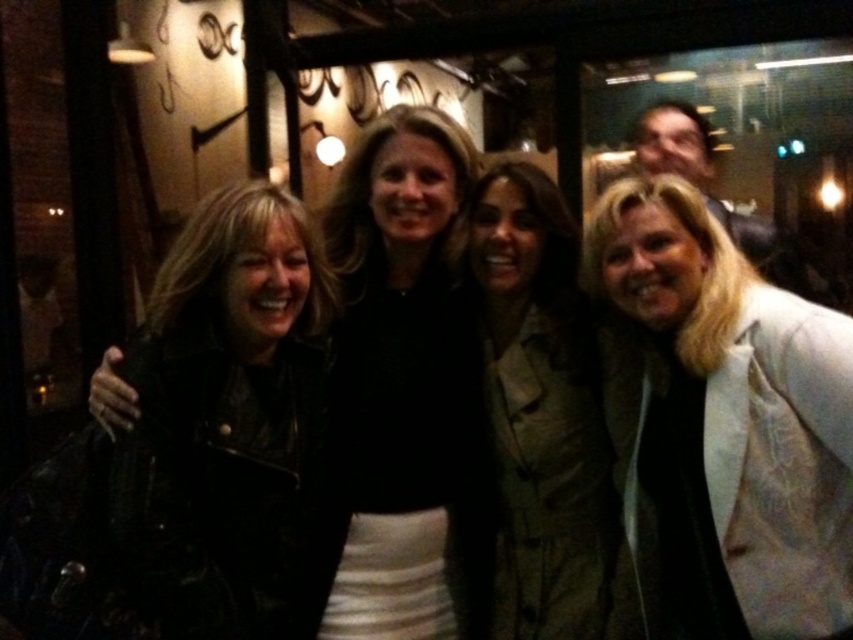
You are a photographer adjusting the camera settings to ensure both the white textured blazer at center and the leather jacket at center are in focus. The camera has a depth of field that can cover 18 inches. Can both items be in focus simultaneously?

The white textured blazer at center and the leather jacket at center are 20.32 inches apart from each other. Since the camera can only cover 18 inches, they cannot both be in focus at the same time.

You are standing at the point closest to the camera in the image. Which point are you at, point (595, 220) or point (585, 582)?

You are at point (595, 220) because it is in front of point (585, 582).